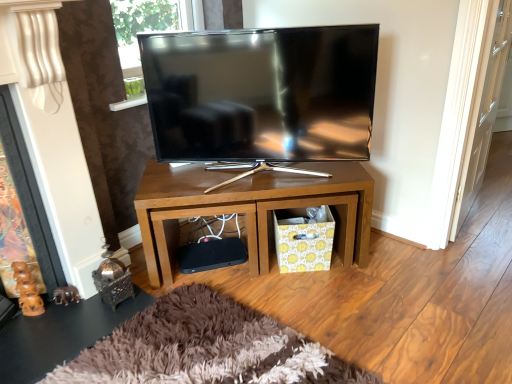
Find the location of `free spot to the right of shiny metallic side table at lower left`. free spot to the right of shiny metallic side table at lower left is located at coordinates (172, 330).